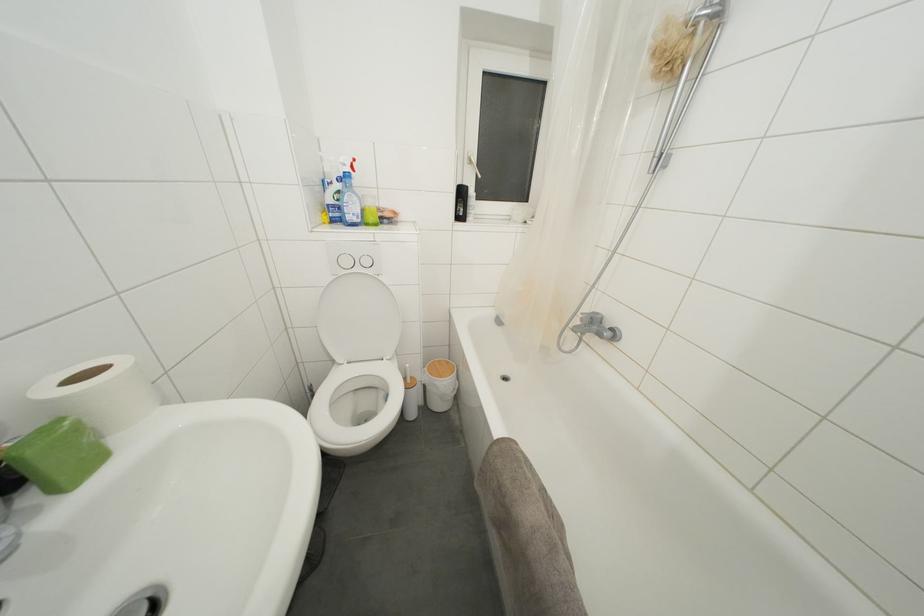
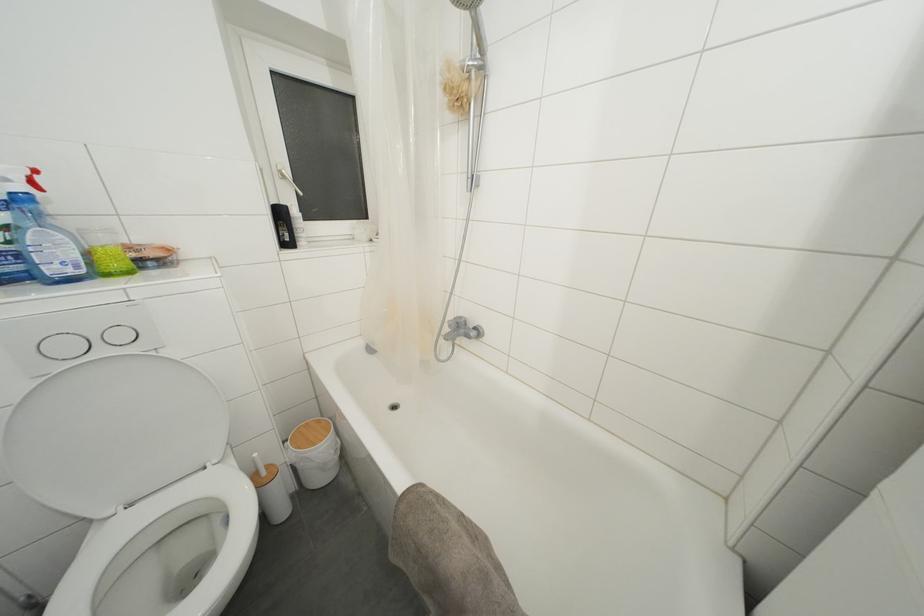
Locate, in the second image, the point that corresponds to (x=444, y=366) in the first image.

(310, 429)